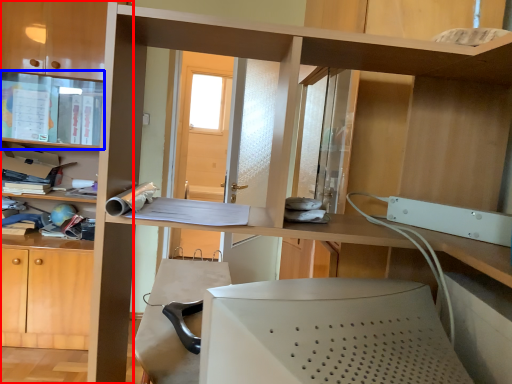
Question: Which point is closer to the camera, bookcase (highlighted by a red box) or cabinet (highlighted by a blue box)?

Choices:
 (A) bookcase
 (B) cabinet

Answer: (A)